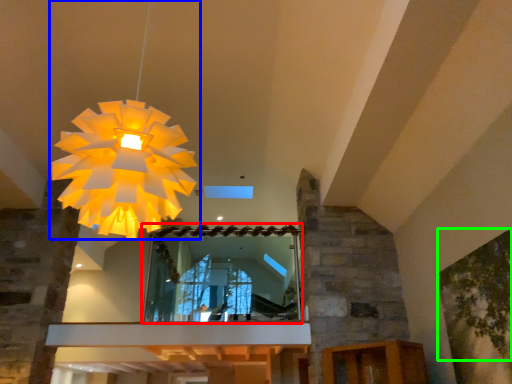
Question: Which object is the closest to the mirror (highlighted by a red box)? Choose among these: lamp (highlighted by a blue box) or tree (highlighted by a green box).

Choices:
 (A) lamp
 (B) tree

Answer: (B)